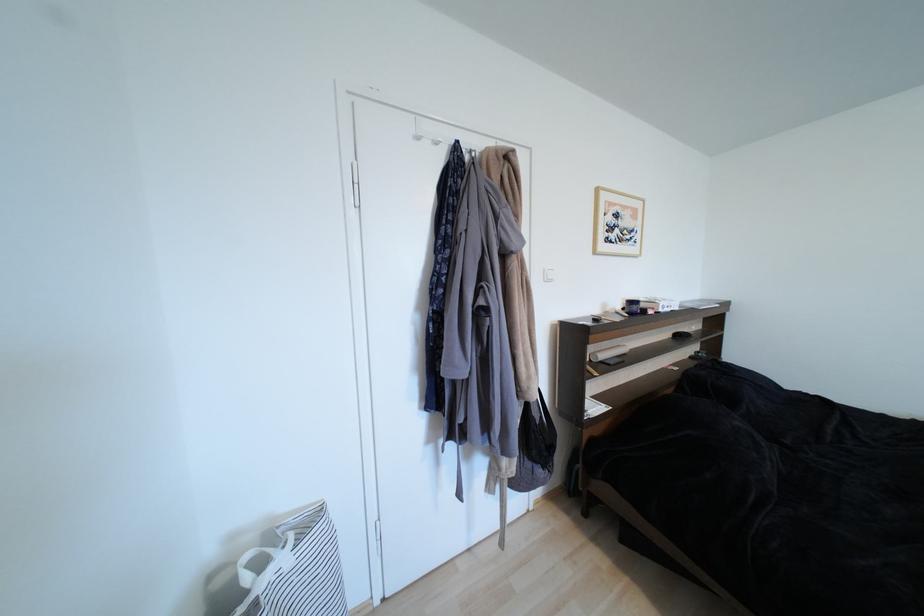
What do you see at coordinates (419, 134) in the screenshot?
I see `a white door hook` at bounding box center [419, 134].